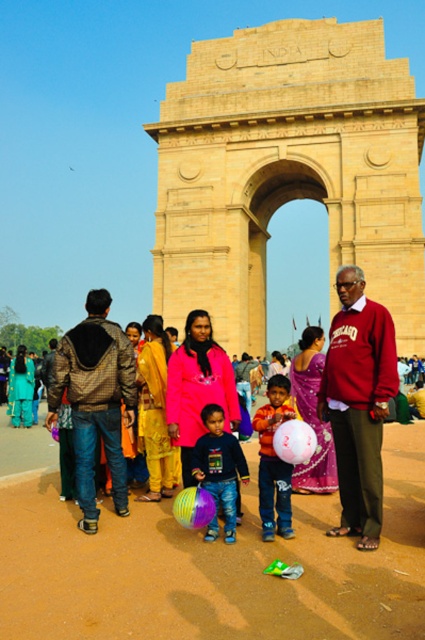
You are a photographer standing at the India Gate monument in New Delhi. You want to take a photo of the brown textured jacket at center. Where should you position yourself to capture it in the frame?

The brown textured jacket at center is located at coordinates point (96, 401), so you should position yourself directly facing the monument and slightly to the right to ensure the jacket is centered in your frame.

You are a photographer standing at the India Gate monument. You want to take a photo that includes both the matte pink balloon at center and the translucent multicolored balloon at center. Given that your camera can capture a maximum distance of 8 meters between objects in focus, will you be able to capture both balloons clearly in the same photo?

The matte pink balloon at center and translucent multicolored balloon at center are 8.18 meters apart from each other. Since the camera can only capture up to 8 meters, the distance between them exceeds the camera limit. Therefore, both balloons cannot be captured clearly in the same photo.

You are a photographer standing at the India Gate monument and want to capture a photo of the multicolored plastic ball at center and the matte pink balloon at center. Which object should you frame first if you want to include both in your shot from left to right?

The multicolored plastic ball at center should be framed first on the left side since it is positioned to the left of the matte pink balloon at center, which is to the right.